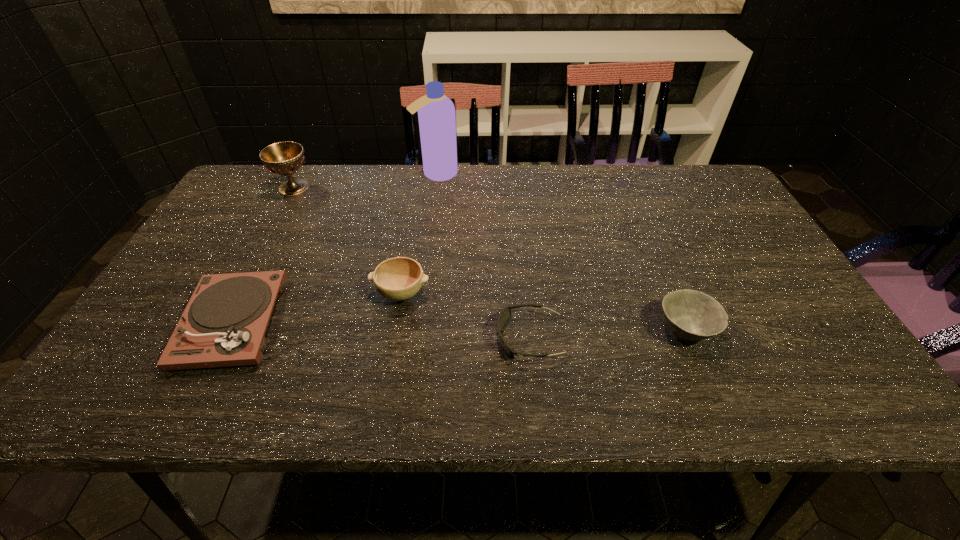
This screenshot has height=540, width=960. I want to click on free space that satisfies the following two spatial constraints: 1. on the back side of the left bowl; 2. on the left side of the tallest object, so click(421, 174).